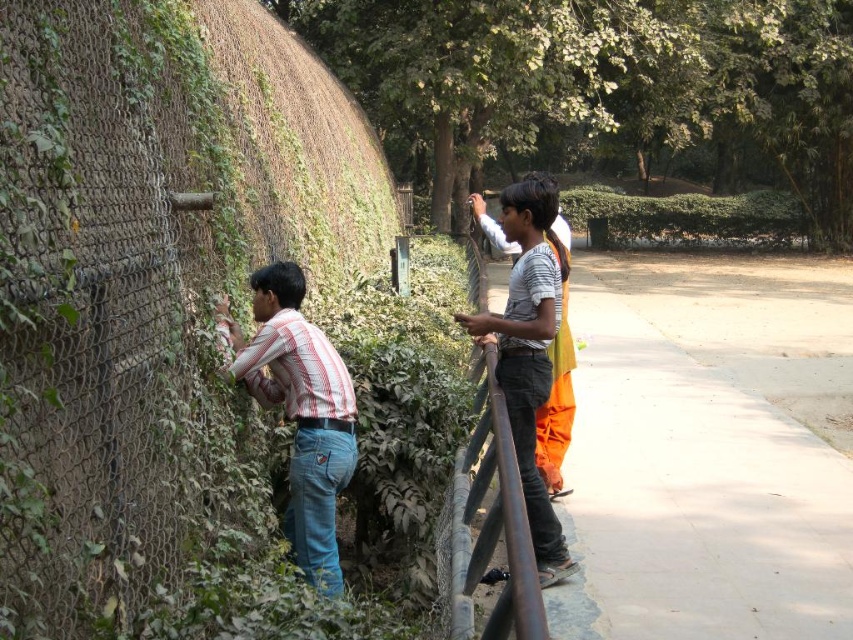
Question: In this image, where is striped cotton shirt at left located relative to rusty metal rail at center?

Choices:
 (A) left
 (B) right

Answer: (A)

Question: Considering the relative positions of striped cotton shirt at left and rusty metal rail at center in the image provided, where is striped cotton shirt at left located with respect to rusty metal rail at center?

Choices:
 (A) left
 (B) right

Answer: (A)

Question: Can you confirm if striped cotton shirt at left is smaller than rusty metal rail at center?

Choices:
 (A) no
 (B) yes

Answer: (A)

Question: Which object is farther from the camera taking this photo?

Choices:
 (A) rusty metal rail at center
 (B) striped cotton shirt at left

Answer: (A)